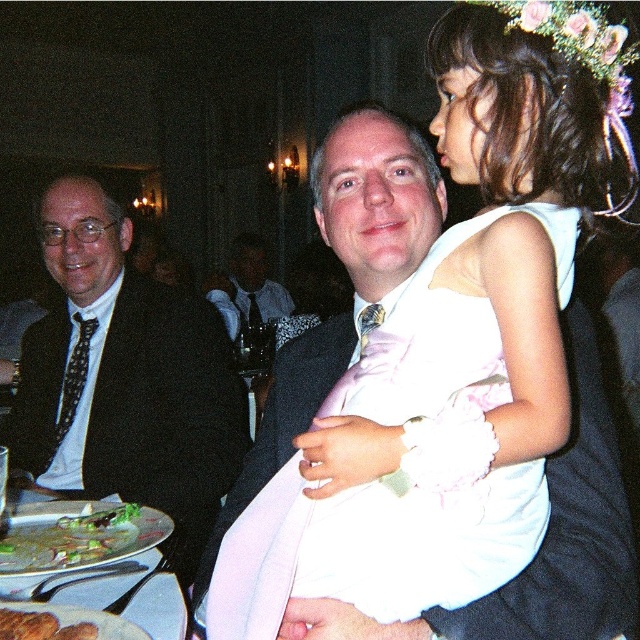
Which of these two, black satin suit at left or matte black suit at center, stands shorter?

With less height is matte black suit at center.

Between point (29, 465) and point (234, 300), which one is positioned behind?

The point (234, 300) is more distant.

The height and width of the screenshot is (640, 640). Describe the element at coordinates (124, 378) in the screenshot. I see `black satin suit at left` at that location.

You are a GUI agent. You are given a task and a screenshot of the screen. Output one action in this format:
    pyautogui.click(x=<x>, y=<y>)
    Task: Click on the black satin suit at left
    This screenshot has height=640, width=640.
    Given the screenshot: What is the action you would take?
    pyautogui.click(x=124, y=378)

Does black satin suit at left appear under metallic silver plate at lower left?

No, black satin suit at left is not below metallic silver plate at lower left.

Find the location of `black satin suit at left`. black satin suit at left is located at coordinates (124, 378).

This screenshot has height=640, width=640. What are the coordinates of `black satin suit at left` in the screenshot? It's located at (124, 378).

Does green leafy vegetables at lower left appear on the left side of matte black suit at center?

No, green leafy vegetables at lower left is not to the left of matte black suit at center.

Does point (67, 518) come closer to viewer compared to point (241, 241)?

That is True.

Who is more distant from viewer, [49,532] or [208,280]?

The point [208,280] is behind.

Locate an element on the screen. This screenshot has height=640, width=640. green leafy vegetables at lower left is located at coordinates (70, 536).